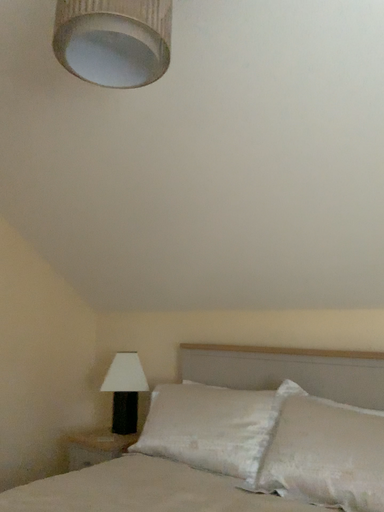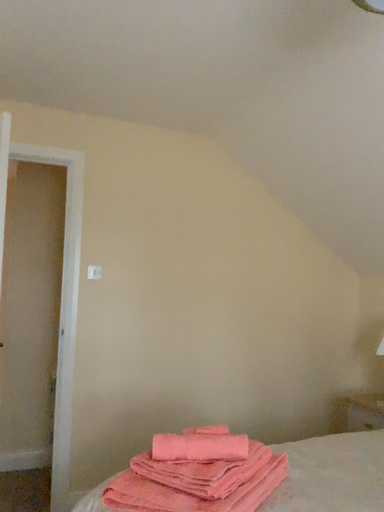
Question: Which way did the camera rotate in the video?

Choices:
 (A) rotated upward
 (B) rotated downward

Answer: (B)